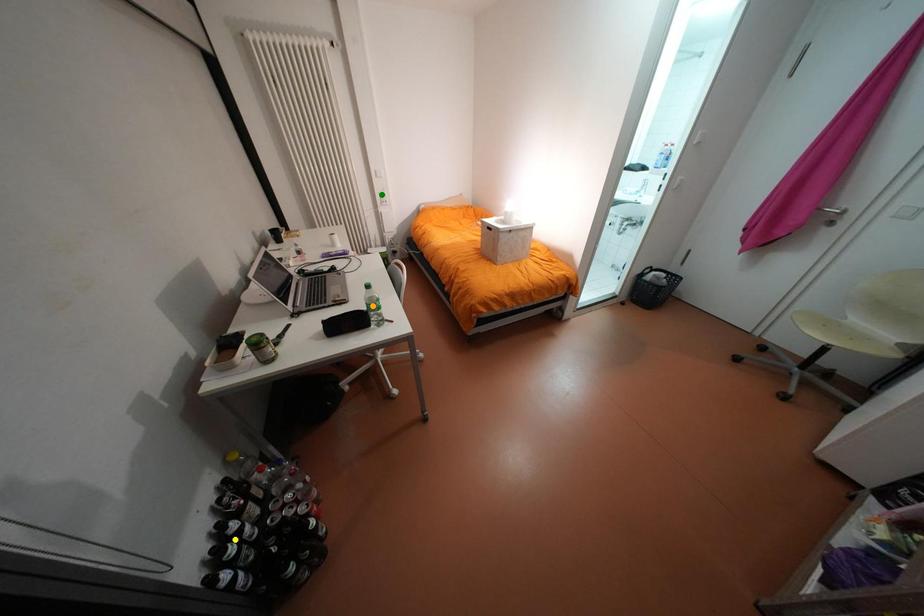
Order these from nearest to farthest:
green point, yellow point, orange point

yellow point, orange point, green point